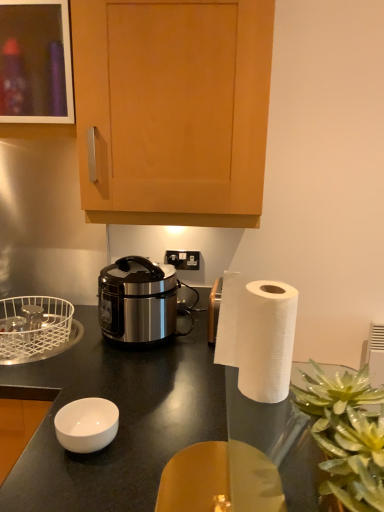
Where is `blank space to the left of white glossy bowl at lower left`? The image size is (384, 512). blank space to the left of white glossy bowl at lower left is located at coordinates (38, 455).